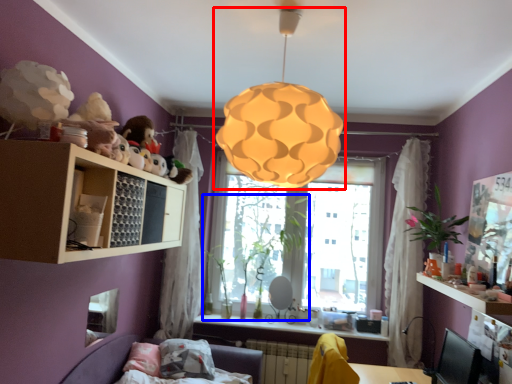
Question: Which object appears closest to the camera in this image, lamp (highlighted by a red box) or plant (highlighted by a blue box)?

Choices:
 (A) lamp
 (B) plant

Answer: (A)